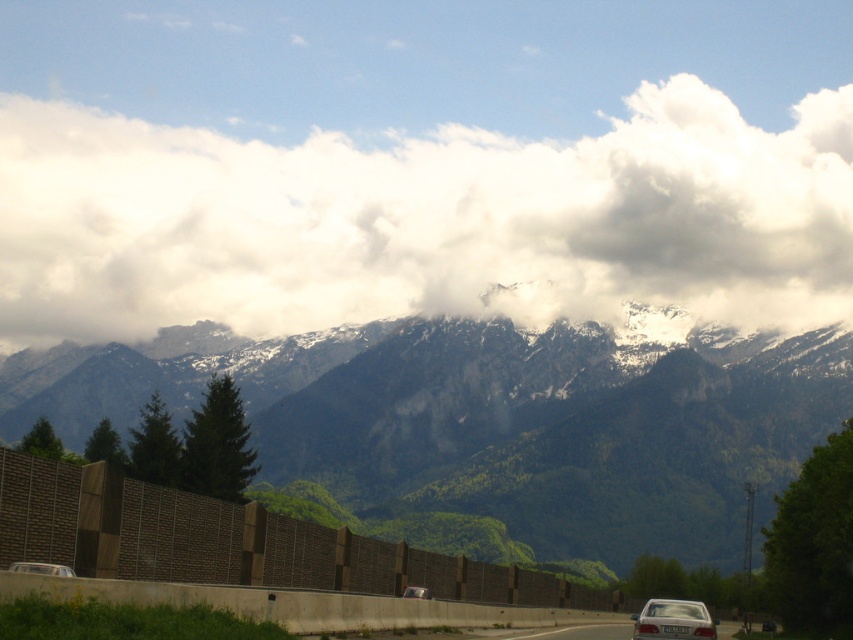
You are standing at the base of the mountain and looking towards the mountain range. There is a point marked at coordinates [425,221]. What object is located at this point?

The point at coordinates [425,221] corresponds to a white fluffy cloud at upper center.

You are a driver approaching a mountain pass and see the white fluffy cloud at upper center and the white glossy car at lower left. Which object is higher in elevation?

The white fluffy cloud at upper center is higher in elevation than the white glossy car at lower left because it is positioned above the car in the scene.